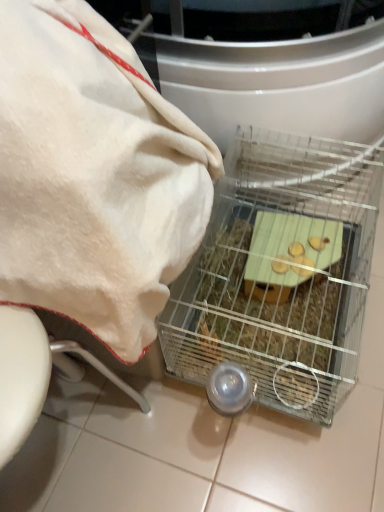
Question: From a real-world perspective, does clear wire cage at center sit lower than white soft towel at upper left?

Choices:
 (A) no
 (B) yes

Answer: (B)

Question: Is clear wire cage at center smaller than white soft towel at upper left?

Choices:
 (A) yes
 (B) no

Answer: (A)

Question: Can you confirm if clear wire cage at center is shorter than white soft towel at upper left?

Choices:
 (A) yes
 (B) no

Answer: (A)

Question: Considering the relative positions of clear wire cage at center and white soft towel at upper left in the image provided, is clear wire cage at center in front of white soft towel at upper left?

Choices:
 (A) no
 (B) yes

Answer: (A)

Question: Does clear wire cage at center have a lesser width compared to white soft towel at upper left?

Choices:
 (A) yes
 (B) no

Answer: (B)

Question: Is clear wire cage at center next to white soft towel at upper left?

Choices:
 (A) no
 (B) yes

Answer: (A)

Question: Considering the relative sizes of white soft towel at upper left and clear wire cage at center in the image provided, is white soft towel at upper left shorter than clear wire cage at center?

Choices:
 (A) yes
 (B) no

Answer: (B)

Question: Is white soft towel at upper left directly adjacent to clear wire cage at center?

Choices:
 (A) yes
 (B) no

Answer: (B)

Question: From a real-world perspective, is white soft towel at upper left positioned under clear wire cage at center based on gravity?

Choices:
 (A) yes
 (B) no

Answer: (B)

Question: From the image's perspective, is white soft towel at upper left over clear wire cage at center?

Choices:
 (A) no
 (B) yes

Answer: (B)

Question: Is white soft towel at upper left completely or partially outside of clear wire cage at center?

Choices:
 (A) yes
 (B) no

Answer: (A)

Question: Does white soft towel at upper left appear on the left side of clear wire cage at center?

Choices:
 (A) yes
 (B) no

Answer: (A)

Question: From a real-world perspective, is clear wire cage at center physically located above or below white soft towel at upper left?

Choices:
 (A) below
 (B) above

Answer: (A)